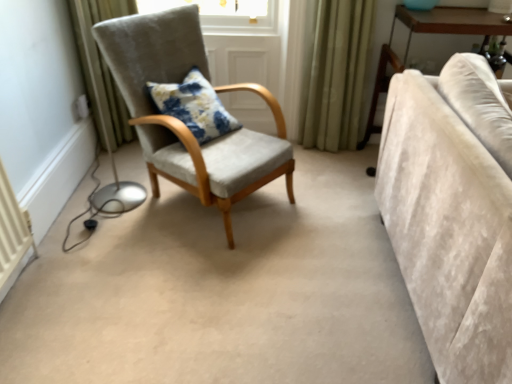
Image resolution: width=512 pixels, height=384 pixels. I want to click on beige velvet couch at right, so click(453, 212).

The width and height of the screenshot is (512, 384). What do you see at coordinates (194, 106) in the screenshot? I see `floral fabric cushion at center` at bounding box center [194, 106].

I want to click on beige velvet couch at right, so tap(453, 212).

From the image's perspective, between beige velvet couch at right and suede/grey chair at center, which one is located above?

suede/grey chair at center is shown above in the image.

Is beige velvet couch at right taller than suede/grey chair at center?

No, beige velvet couch at right is not taller than suede/grey chair at center.

Considering the positions of objects beige velvet couch at right and suede/grey chair at center in the image provided, who is more to the left, beige velvet couch at right or suede/grey chair at center?

Positioned to the left is suede/grey chair at center.

What's the angular difference between beige velvet couch at right and suede/grey chair at center's facing directions?

42.2 degrees.

Between suede/grey chair at center and beige velvet couch at right, which one appears on the left side from the viewer's perspective?

suede/grey chair at center is more to the left.

You are a GUI agent. You are given a task and a screenshot of the screen. Output one action in this format:
    pyautogui.click(x=<x>, y=<y>)
    Task: Click on the chair above the beige velvet couch at right (from a real-world perspective)
    The image size is (512, 384).
    Given the screenshot: What is the action you would take?
    pyautogui.click(x=183, y=123)

Consider the image. Considering the positions of objects suede/grey chair at center and beige velvet couch at right in the image provided, who is behind, suede/grey chair at center or beige velvet couch at right?

suede/grey chair at center is more distant.

Looking at their sizes, would you say suede/grey chair at center is wider or thinner than beige velvet couch at right?

Clearly, suede/grey chair at center has more width compared to beige velvet couch at right.

Is beige velvet couch at right at the back of light brown wooden table at right?

No.

Considering the positions of objects light brown wooden table at right and beige velvet couch at right in the image provided, who is more to the left, light brown wooden table at right or beige velvet couch at right?

From the viewer's perspective, beige velvet couch at right appears more on the left side.

Is light brown wooden table at right next to beige velvet couch at right and touching it?

No, light brown wooden table at right is not next to beige velvet couch at right.

Considering the sizes of light brown wooden table at right and beige velvet couch at right in the image, is light brown wooden table at right taller or shorter than beige velvet couch at right?

Clearly, light brown wooden table at right is taller compared to beige velvet couch at right.

Is the depth of light brown wooden table at right greater than that of floral fabric cushion at center?

Yes.

Considering the sizes of objects light brown wooden table at right and floral fabric cushion at center in the image provided, who is wider, light brown wooden table at right or floral fabric cushion at center?

Wider between the two is light brown wooden table at right.

From a real-world perspective, between light brown wooden table at right and floral fabric cushion at center, who is vertically higher?

From a 3D spatial view, floral fabric cushion at center is above.

Is floral fabric cushion at center closer to camera compared to light brown wooden table at right?

Yes, the depth of floral fabric cushion at center is less than that of light brown wooden table at right.

Is floral fabric cushion at center located outside light brown wooden table at right?

floral fabric cushion at center lies outside light brown wooden table at right's area.

Which of these two, floral fabric cushion at center or light brown wooden table at right, is thinner?

With smaller width is floral fabric cushion at center.

Is beige velvet couch at right not inside floral fabric cushion at center?

Absolutely, beige velvet couch at right is external to floral fabric cushion at center.

Which is more to the left, beige velvet couch at right or floral fabric cushion at center?

floral fabric cushion at center is more to the left.

Relative to floral fabric cushion at center, is beige velvet couch at right in front or behind?

beige velvet couch at right is in front of floral fabric cushion at center.

Would you consider beige velvet couch at right to be distant from floral fabric cushion at center?

Yes, beige velvet couch at right and floral fabric cushion at center are located far from each other.

In the scene shown: Considering the sizes of objects suede/grey chair at center and light brown wooden table at right in the image provided, who is taller, suede/grey chair at center or light brown wooden table at right?

Standing taller between the two is suede/grey chair at center.

Does point (161, 31) lie in front of point (508, 32)?

That is True.

Is suede/grey chair at center in contact with light brown wooden table at right?

suede/grey chair at center is not next to light brown wooden table at right, and they're not touching.

Where is `chair on the left of the beige velvet couch at right`? The height and width of the screenshot is (384, 512). chair on the left of the beige velvet couch at right is located at coordinates (183, 123).

Locate an element on the screen. studio couch on the right of suede/grey chair at center is located at coordinates (453, 212).

Estimate the real-world distances between objects in this image. Which object is further from light brown wooden table at right, beige velvet couch at right or floral fabric cushion at center?

Based on the image, floral fabric cushion at center appears to be further to light brown wooden table at right.

Looking at the image, which one is located further to beige velvet couch at right, floral fabric cushion at center or suede/grey chair at center?

Among the two, floral fabric cushion at center is located further to beige velvet couch at right.

From the image, which object appears to be nearer to beige velvet couch at right, light brown wooden table at right or floral fabric cushion at center?

light brown wooden table at right lies closer to beige velvet couch at right than the other object.

Considering their positions, is floral fabric cushion at center positioned further to beige velvet couch at right than light brown wooden table at right?

floral fabric cushion at center is further to beige velvet couch at right.

Based on their spatial positions, is floral fabric cushion at center or suede/grey chair at center closer to light brown wooden table at right?

suede/grey chair at center is closer to light brown wooden table at right.

Considering their positions, is suede/grey chair at center positioned closer to floral fabric cushion at center than light brown wooden table at right?

The object closer to floral fabric cushion at center is suede/grey chair at center.

Based on their spatial positions, is floral fabric cushion at center or light brown wooden table at right closer to suede/grey chair at center?

Among the two, floral fabric cushion at center is located nearer to suede/grey chair at center.

When comparing their distances from light brown wooden table at right, does suede/grey chair at center or beige velvet couch at right seem closer?

The object closer to light brown wooden table at right is beige velvet couch at right.

Where is `chair between floral fabric cushion at center and light brown wooden table at right`? The width and height of the screenshot is (512, 384). chair between floral fabric cushion at center and light brown wooden table at right is located at coordinates (183, 123).

At what (x,y) coordinates should I click in order to perform the action: click on studio couch between suede/grey chair at center and light brown wooden table at right. Please return your answer as a coordinate pair (x, y). Image resolution: width=512 pixels, height=384 pixels. Looking at the image, I should click on (453, 212).

Find the location of a particular element. The image size is (512, 384). studio couch between floral fabric cushion at center and light brown wooden table at right in the horizontal direction is located at coordinates (453, 212).

At what (x,y) coordinates should I click in order to perform the action: click on chair between floral fabric cushion at center and beige velvet couch at right from left to right. Please return your answer as a coordinate pair (x, y). The width and height of the screenshot is (512, 384). Looking at the image, I should click on (183, 123).